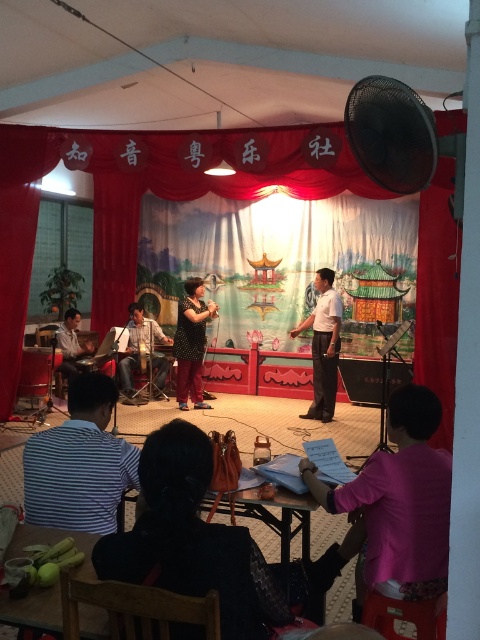
You are a photographer at the event and want to take a photo of the stage. The pink fabric at lower right is blocking your view. Where should you move to avoid it?

Move to the left side of the stage to avoid the pink fabric at lower right blocking your view.

You are an audience member sitting in the front row of the stage. You notice two points marked on the stage. The first point is at coordinate point (x=417, y=588) and the second is at coordinate point (x=317, y=374). Which point is closer to you?

Point (x=417, y=588) is in front of point (x=317, y=374), so the first point is closer to you.

You are an audience member sitting in the front row of the event. You notice the striped fabric shirt at lower left and the light brown wooden drum at center. Which object is closer to the stage edge?

The striped fabric shirt at lower left is closer to the stage edge because it is positioned under the light brown wooden drum at center, which is further back on the stage.